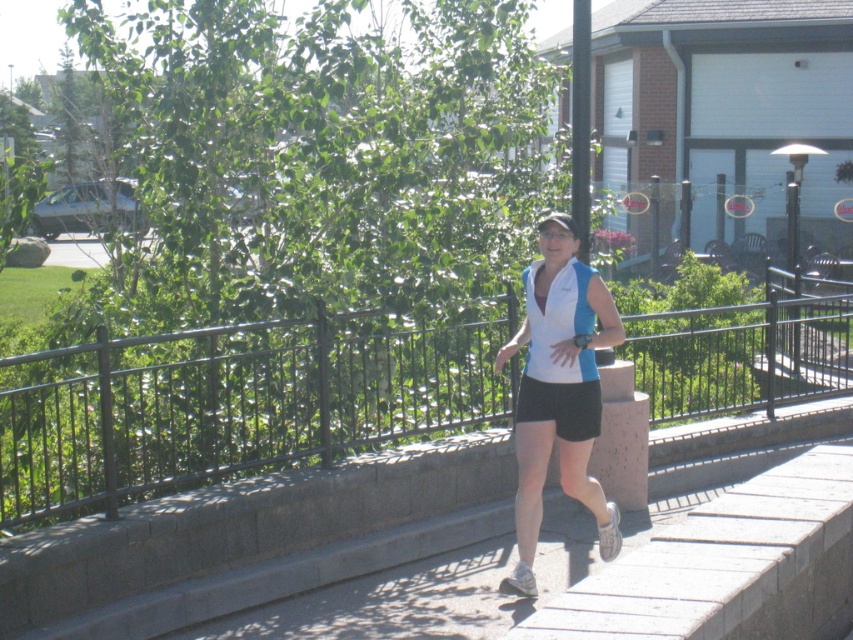
You are a photographer trying to capture the jogger in the scene. The black metal rail at center and the white fabric shirt at center are both in your view. Which object is shorter in height?

The black metal rail at center has a lesser height compared to the white fabric shirt at center, so the black metal rail at center is shorter in height.

You are a photographer standing at the point with coordinates (560, 388). You want to capture the person jogging on the paved pathway. Where should you position yourself relative to the white fabric shirt at center to frame the shot properly?

The point with coordinates (560, 388) is where the white fabric shirt at center is located. To frame the shot properly, position yourself directly at that point to capture the person jogging on the paved pathway.

You are a drone operator trying to capture a photo of the jogging person. The drone is currently at the point marked by point (231, 404). To get a clear shot, you need to move the drone either left or right along the pathway. Which direction should you move the drone to ensure the jogging person is in the frame?

The point (231, 404) represents the black metal rail at center. Since the jogging person is on the pathway bordered by this rail, moving the drone to the right would position it closer to the person, ensuring they are in the frame.